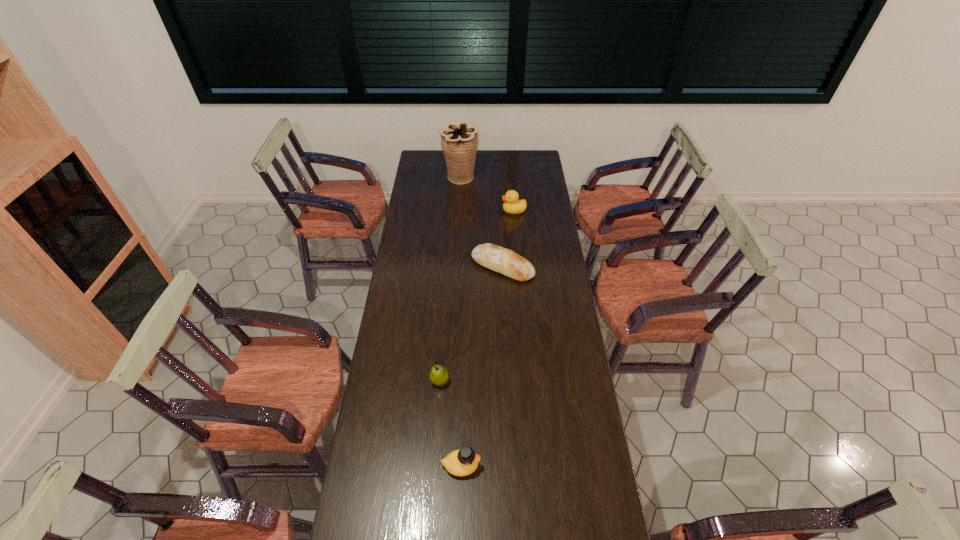
Find the location of a particular element. free region located at the beak of the right duck is located at coordinates (440, 211).

At what (x,y) coordinates should I click in order to perform the action: click on vacant position located at the beak of the right duck. Please return your answer as a coordinate pair (x, y). The width and height of the screenshot is (960, 540). Looking at the image, I should click on (476, 211).

This screenshot has width=960, height=540. I want to click on free region located on the front-facing side of the shorter duck, so click(502, 465).

The width and height of the screenshot is (960, 540). I want to click on blank space located on the front of the pear, so click(x=433, y=482).

Identify the location of blank space located on the front of the third farthest object. (507, 358).

Where is `object positioned at the far edge`? This screenshot has height=540, width=960. object positioned at the far edge is located at coordinates (459, 141).

Identify the location of duck positioned at the right edge. Image resolution: width=960 pixels, height=540 pixels. (512, 205).

At what (x,y) coordinates should I click in order to perform the action: click on bread situated at the right edge. Please return your answer as a coordinate pair (x, y). The width and height of the screenshot is (960, 540). Looking at the image, I should click on pos(496,258).

This screenshot has width=960, height=540. I want to click on vacant space at the left edge of the desktop, so click(439, 177).

Where is `vacant area at the right edge of the desktop`? This screenshot has height=540, width=960. vacant area at the right edge of the desktop is located at coordinates (548, 266).